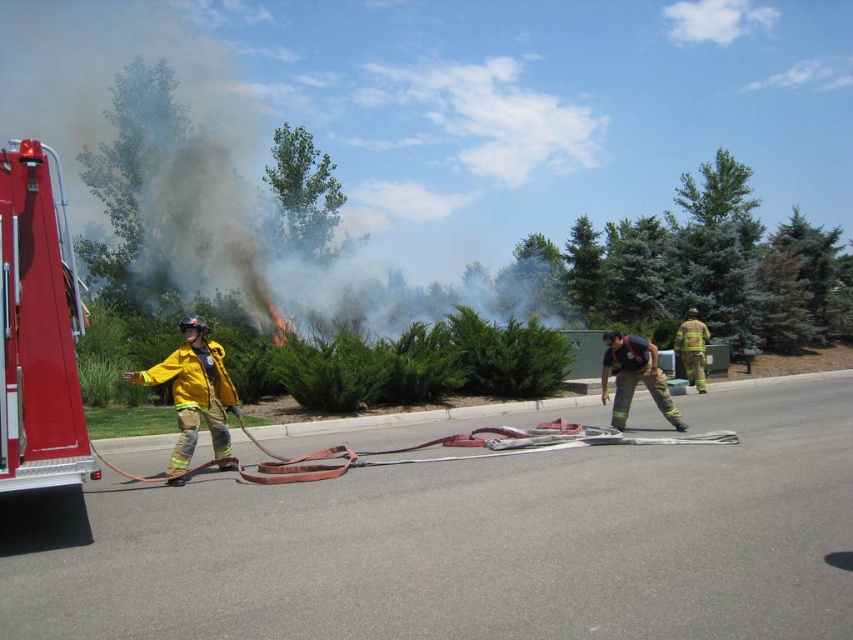
Question: Which point appears farthest from the camera in this image?

Choices:
 (A) (701, 364)
 (B) (189, 326)
 (C) (10, 326)

Answer: (A)

Question: From the image, what is the correct spatial relationship of shiny red fire truck at left in relation to yellow reflective uniform at center?

Choices:
 (A) below
 (B) above

Answer: (B)

Question: Does shiny red fire truck at left appear under yellow fireproof suit at center?

Choices:
 (A) yes
 (B) no

Answer: (B)

Question: Among these points, which one is farthest from the camera?

Choices:
 (A) (216, 344)
 (B) (698, 364)
 (C) (51, 97)

Answer: (C)

Question: Among these points, which one is farthest from the camera?

Choices:
 (A) (38, 96)
 (B) (38, 476)
 (C) (604, 385)
 (D) (234, 403)

Answer: (A)

Question: Can you confirm if smoketransparent at upper center is positioned below yellow reflective uniform at center?

Choices:
 (A) yes
 (B) no

Answer: (B)